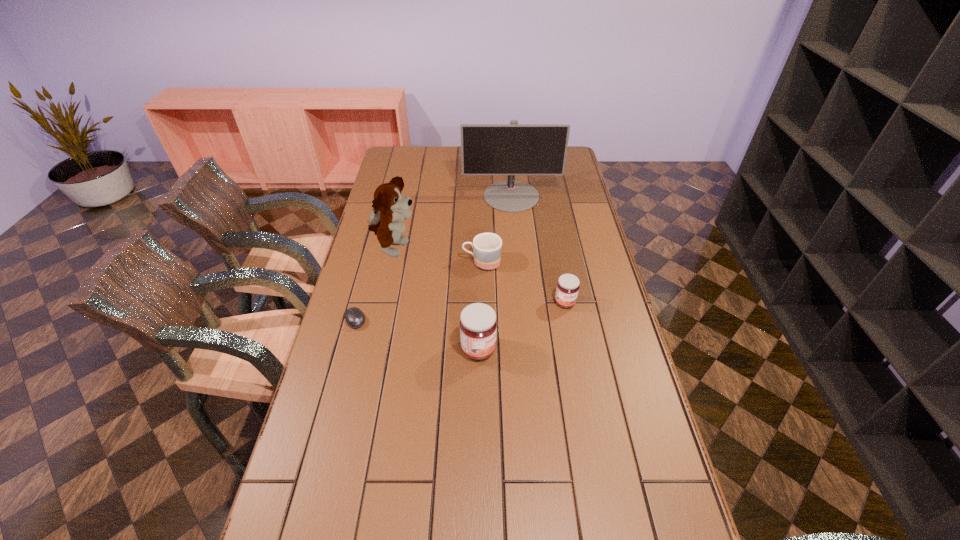
The height and width of the screenshot is (540, 960). Identify the location of the left jam. (478, 325).

The image size is (960, 540). I want to click on the third tallest object, so click(x=478, y=325).

I want to click on the right jam, so click(567, 289).

Locate an element on the screen. the shorter jam is located at coordinates (567, 289).

Find the location of `the farthest object`. the farthest object is located at coordinates (512, 149).

Where is `puppy`? Image resolution: width=960 pixels, height=540 pixels. puppy is located at coordinates (390, 207).

Where is `computer mouse`? The image size is (960, 540). computer mouse is located at coordinates (355, 318).

You are a GUI agent. You are given a task and a screenshot of the screen. Output one action in this format:
    pyautogui.click(x=<x>, y=<y>)
    Task: Click on the mug
    Image resolution: width=960 pixels, height=540 pixels.
    Given the screenshot: What is the action you would take?
    pyautogui.click(x=487, y=247)

Locate an element on the screen. vacant space located 0.130m on the left of the nearer jam is located at coordinates (417, 349).

This screenshot has width=960, height=540. Find the location of `free space located on the left of the shorter jam`. free space located on the left of the shorter jam is located at coordinates (539, 302).